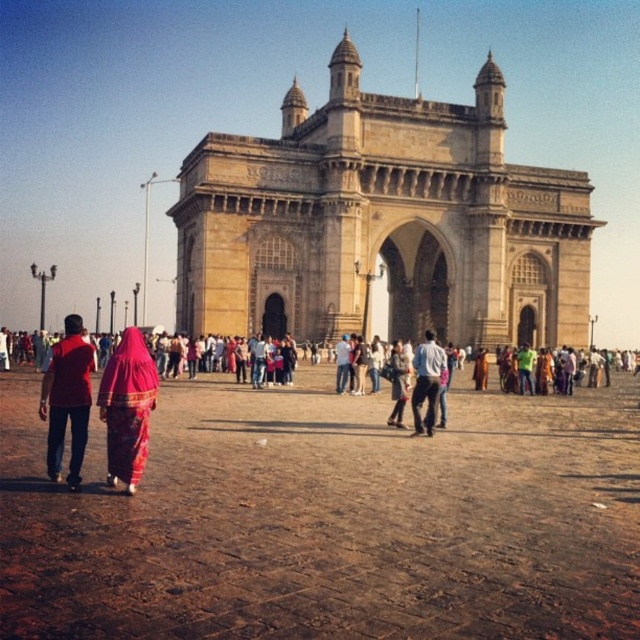
Between brown stone dirt field at center and matte red shirt at left, which one has more height?

matte red shirt at left

Between brown stone dirt field at center and matte red shirt at left, which one is positioned higher?

matte red shirt at left

Where is `brown stone dirt field at center`? The height and width of the screenshot is (640, 640). brown stone dirt field at center is located at coordinates (330, 518).

Between beige stone gateway of india at center and matte red shirt at left, which one is positioned lower?

matte red shirt at left is lower down.

What do you see at coordinates (381, 221) in the screenshot?
I see `beige stone gateway of india at center` at bounding box center [381, 221].

At what (x,y) coordinates should I click in order to perform the action: click on beige stone gateway of india at center. Please return your answer as a coordinate pair (x, y). The width and height of the screenshot is (640, 640). Looking at the image, I should click on (381, 221).

Is beige stone gateway of india at center smaller than denim jacket at center?

No.

Does beige stone gateway of india at center appear on the left side of denim jacket at center?

Correct, you'll find beige stone gateway of india at center to the left of denim jacket at center.

Does point (208, 205) come in front of point (428, 355)?

No.

Where is `beige stone gateway of india at center`? Image resolution: width=640 pixels, height=640 pixels. beige stone gateway of india at center is located at coordinates [381, 221].